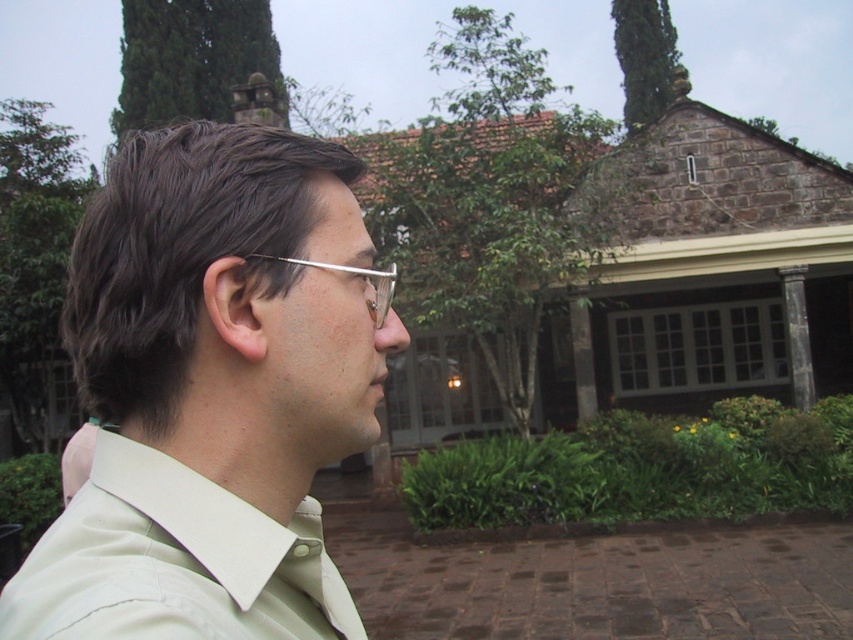
Question: Is light beige shirt at center smaller than beige cotton dress shirt at center?

Choices:
 (A) no
 (B) yes

Answer: (A)

Question: Is light beige shirt at center positioned behind beige cotton dress shirt at center?

Choices:
 (A) no
 (B) yes

Answer: (B)

Question: Is light beige shirt at center positioned before beige cotton dress shirt at center?

Choices:
 (A) yes
 (B) no

Answer: (B)

Question: Which of these objects is positioned closest to the beige cotton dress shirt at center?

Choices:
 (A) clear plastic glasses at center
 (B) light beige shirt at center

Answer: (B)

Question: Which point is farther from the camera taking this photo?

Choices:
 (A) (306, 612)
 (B) (384, 294)
 (C) (103, 212)

Answer: (B)

Question: Which point is farther from the camera taking this photo?

Choices:
 (A) (372, 282)
 (B) (236, 364)
 (C) (73, 516)

Answer: (A)